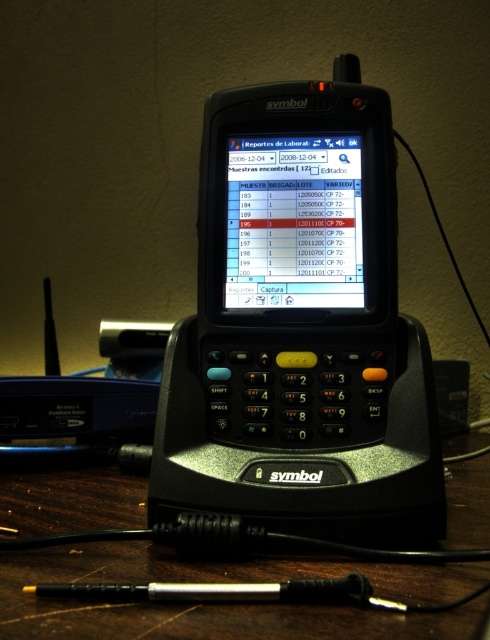
Question: Which object is farther from the camera taking this photo?

Choices:
 (A) black plastic table at center
 (B) black plastic phone at center

Answer: (B)

Question: Among these objects, which one is farthest from the camera?

Choices:
 (A) black plastic table at center
 (B) black plastic phone at center

Answer: (B)

Question: Is black plastic phone at center in front of black plastic table at center?

Choices:
 (A) yes
 (B) no

Answer: (B)

Question: Is black plastic phone at center to the left of black plastic table at center from the viewer's perspective?

Choices:
 (A) yes
 (B) no

Answer: (A)

Question: Which of the following is the farthest from the observer?

Choices:
 (A) (393, 477)
 (B) (102, 621)

Answer: (A)

Question: Is black plastic phone at center positioned before black plastic table at center?

Choices:
 (A) yes
 (B) no

Answer: (B)